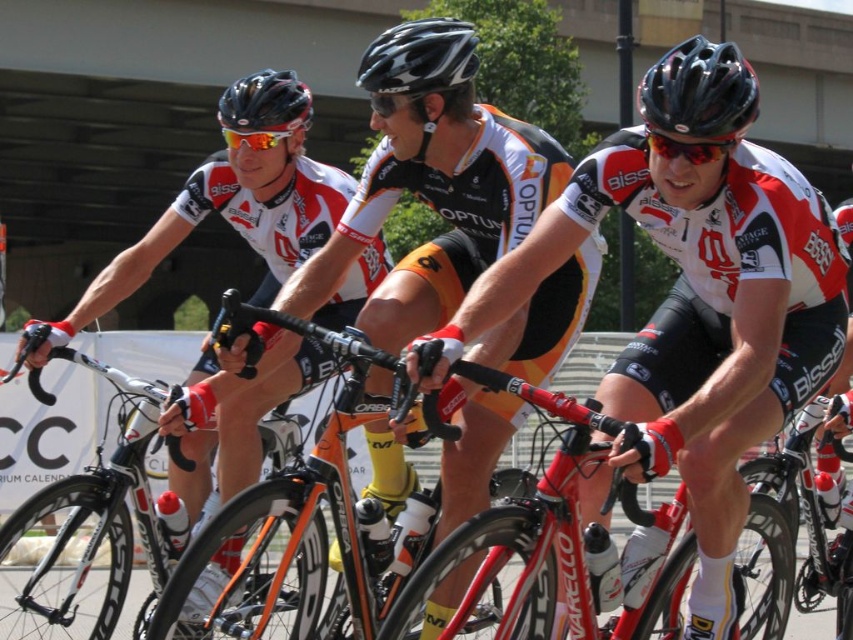
You are a photographer positioned at the starting line of a cycling race. You want to capture a photo of both the black matte helmet at upper right and the matte black helmet at upper center in the same frame. Based on their positions, which helmet will appear closer to the bottom edge of the photo?

The black matte helmet at upper right is shorter than the matte black helmet at upper center, so it will appear closer to the bottom edge of the photo.

You are a photographer positioned at the starting line of the race. You want to capture a photo that includes both the point at coordinates point (x=490, y=212) and point (x=809, y=522). Which point should you focus on first to ensure both are in sharp focus?

You should focus on point (x=490, y=212) first because it is closer to you than point (x=809, y=522). This ensures the depth of field captures both points effectively.

You are a photographer positioned at the origin point of the image. You need to capture a photo of the orange and black jersey at center. What are the coordinates where you should aim your camera to ensure the jersey is centered in the frame?

The orange and black jersey at center is located at coordinates point (434, 209), so you should aim your camera at those coordinates to center it in the frame.